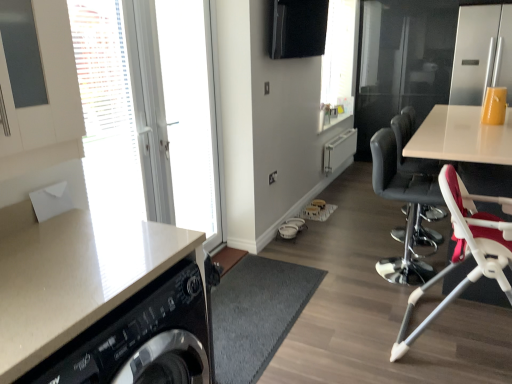
Locate an element on the screen. The width and height of the screenshot is (512, 384). vacant area situated to the left side of red fabric high chair at right, positioned as the second chair in back-to-front order is located at coordinates (356, 332).